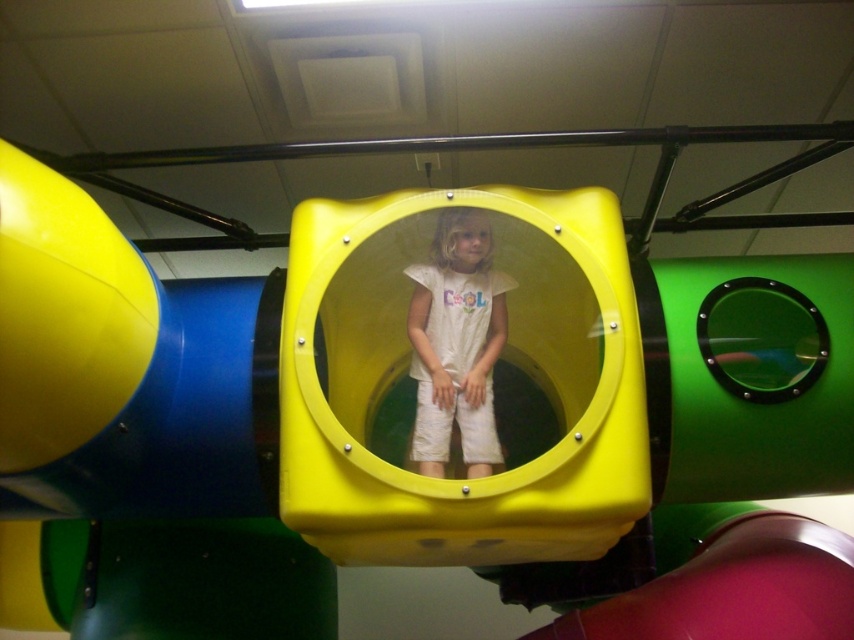
Between rubberized red slide at lower right and white matte/soft fabric at center, which one has less height?

Standing shorter between the two is rubberized red slide at lower right.

Can you confirm if rubberized red slide at lower right is positioned to the right of white matte/soft fabric at center?

Correct, you'll find rubberized red slide at lower right to the right of white matte/soft fabric at center.

Does point (823, 602) come in front of point (446, 317)?

Yes, point (823, 602) is closer to viewer.

Find the location of a particular element. This screenshot has height=640, width=854. rubberized red slide at lower right is located at coordinates (734, 589).